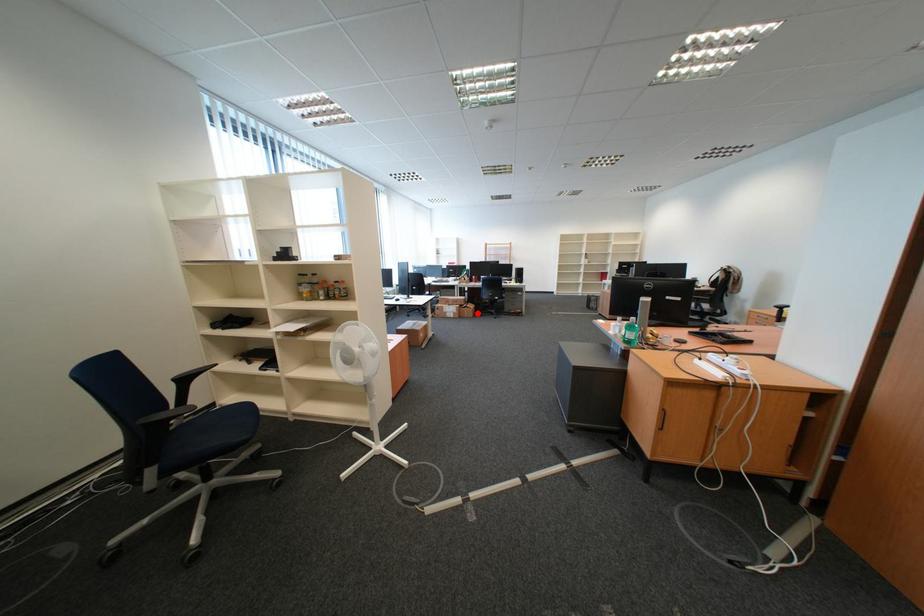
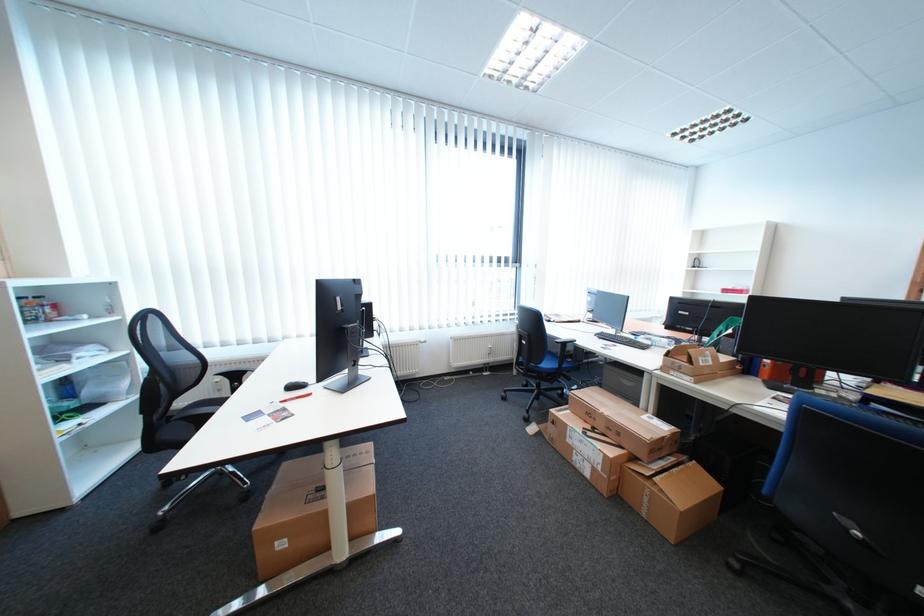
Question: I am providing you with two images of the same scene from different viewpoints. A red point is marked on the first image. At the location where the point appears in image 1, is it still visible in image 2?

Choices:
 (A) Yes
 (B) No

Answer: (A)